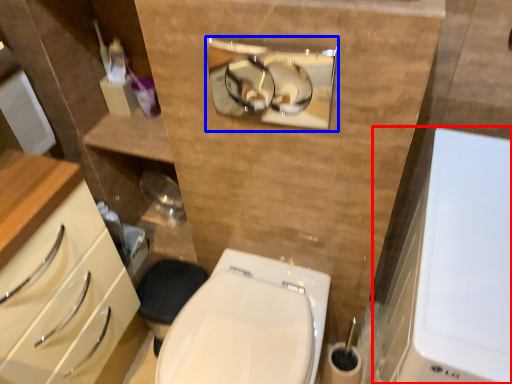
Question: Which object appears farthest to the camera in this image, medicine cabinet (highlighted by a red box) or medicine cabinet (highlighted by a blue box)?

Choices:
 (A) medicine cabinet
 (B) medicine cabinet

Answer: (B)